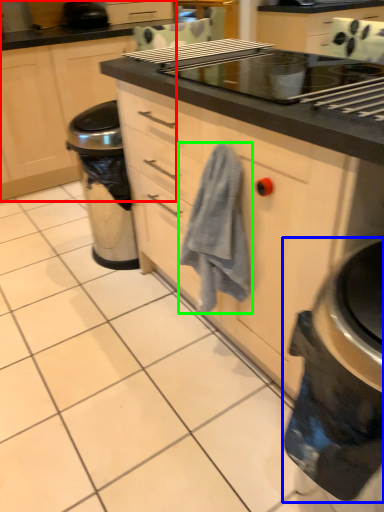
Question: Considering the real-world distances, which object is farthest from cabinetry (highlighted by a red box)? home appliance (highlighted by a blue box) or bath towel (highlighted by a green box)?

Choices:
 (A) home appliance
 (B) bath towel

Answer: (A)